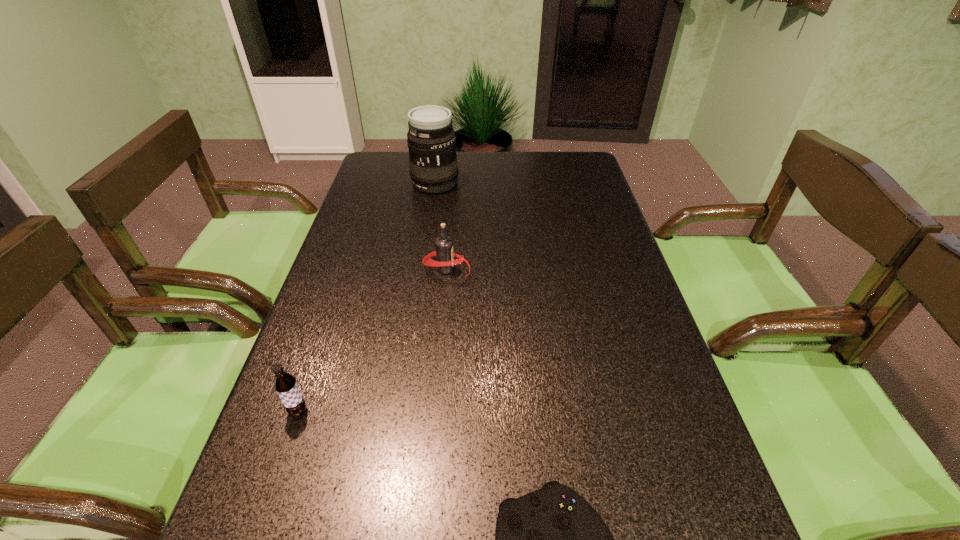
You are a GUI agent. You are given a task and a screenshot of the screen. Output one action in this format:
    pyautogui.click(x=<x>, y=<y>)
    Task: Click on the telephoto lens
    
    Given the screenshot: What is the action you would take?
    pyautogui.click(x=431, y=140)

What are the coordinates of `the tallest object` in the screenshot? It's located at (431, 140).

You are a GUI agent. You are given a task and a screenshot of the screen. Output one action in this format:
    pyautogui.click(x=<x>, y=<y>)
    Task: Click on the right root beer
    This screenshot has width=960, height=540.
    Given the screenshot: What is the action you would take?
    [x=444, y=253]

The image size is (960, 540). Find the location of `the farther root beer`. the farther root beer is located at coordinates (444, 253).

Where is `the third farthest object`? The width and height of the screenshot is (960, 540). the third farthest object is located at coordinates (285, 384).

At what (x,y) coordinates should I click in order to perform the action: click on the leftmost object. Please return your answer as a coordinate pair (x, y). This screenshot has width=960, height=540. Looking at the image, I should click on (285, 384).

Image resolution: width=960 pixels, height=540 pixels. Identify the location of free space located on the front of the tallest object. (424, 257).

Locate an element on the screen. Image resolution: width=960 pixels, height=540 pixels. vacant space located 0.090m on the label of the right root beer is located at coordinates (505, 269).

Locate an element on the screen. free space located on the right of the leftmost object is located at coordinates (387, 411).

Where is `object located in the far edge section of the desktop`? The width and height of the screenshot is (960, 540). object located in the far edge section of the desktop is located at coordinates (431, 140).